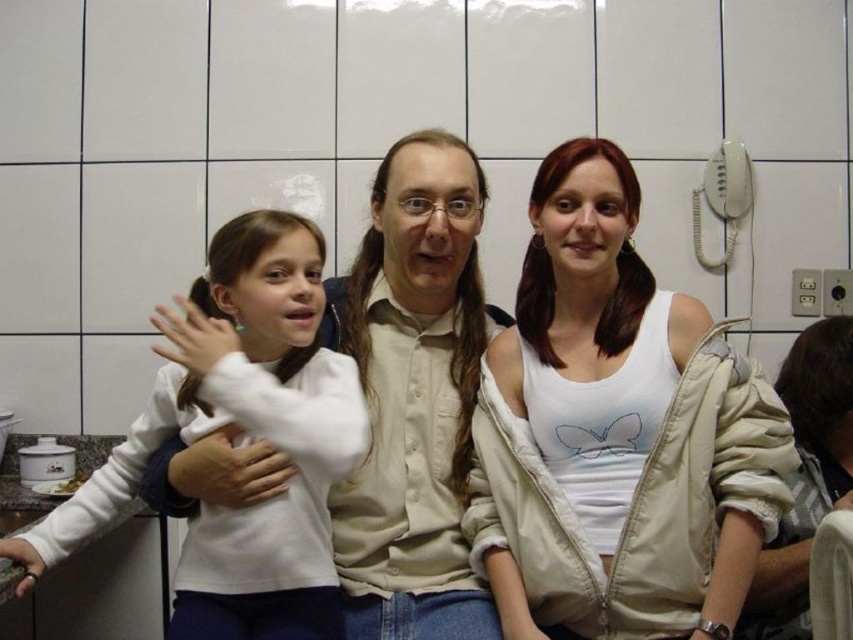
Describe the element at coordinates (616, 433) in the screenshot. The height and width of the screenshot is (640, 853). I see `white cotton tank top at center` at that location.

Is white cotton tank top at center above white matte shirt at center?

No.

Which is behind, point (502, 621) or point (392, 424)?

Positioned behind is point (392, 424).

The image size is (853, 640). In order to click on white cotton tank top at center in this screenshot , I will do `click(616, 433)`.

Does white cotton tank top at center appear over white soft fabric shirt at left?

Indeed, white cotton tank top at center is positioned over white soft fabric shirt at left.

Which of these two, white cotton tank top at center or white soft fabric shirt at left, stands shorter?

white soft fabric shirt at left

Where is `white cotton tank top at center`? The height and width of the screenshot is (640, 853). white cotton tank top at center is located at coordinates (616, 433).

Where is `white matte shirt at center`? The image size is (853, 640). white matte shirt at center is located at coordinates (415, 397).

Which of these two, white matte shirt at center or white soft fabric shirt at left, stands shorter?

white soft fabric shirt at left

Which is in front, point (416, 560) or point (293, 349)?

Positioned in front is point (293, 349).

The height and width of the screenshot is (640, 853). What are the coordinates of `white matte shirt at center` in the screenshot? It's located at (415, 397).